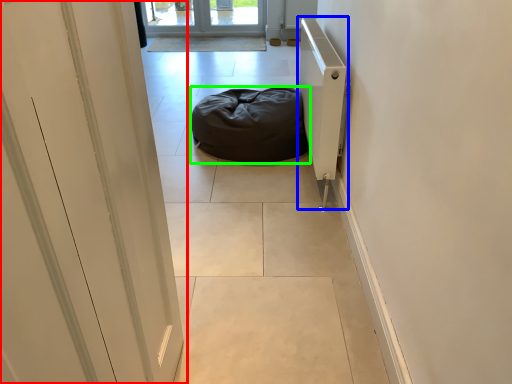
Question: Estimate the real-world distances between objects in this image. Which object is closer to door (highlighted by a red box), radiator (highlighted by a blue box) or furniture (highlighted by a green box)?

Choices:
 (A) radiator
 (B) furniture

Answer: (A)